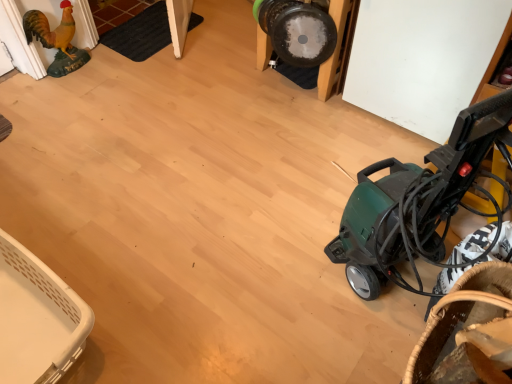
Find the location of a particular element. The height and width of the screenshot is (384, 512). vacant region to the left of green plastic vacuum cleaner at right is located at coordinates (284, 272).